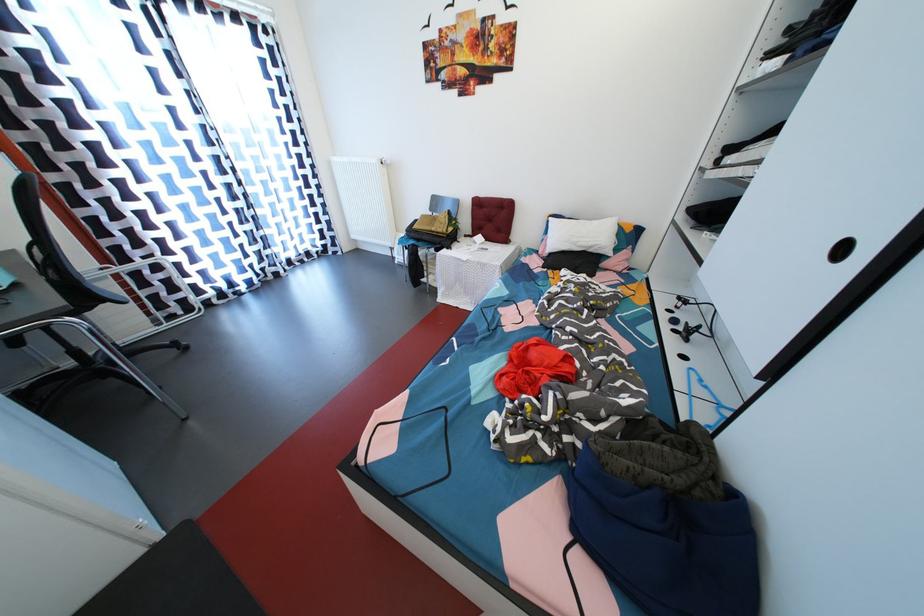
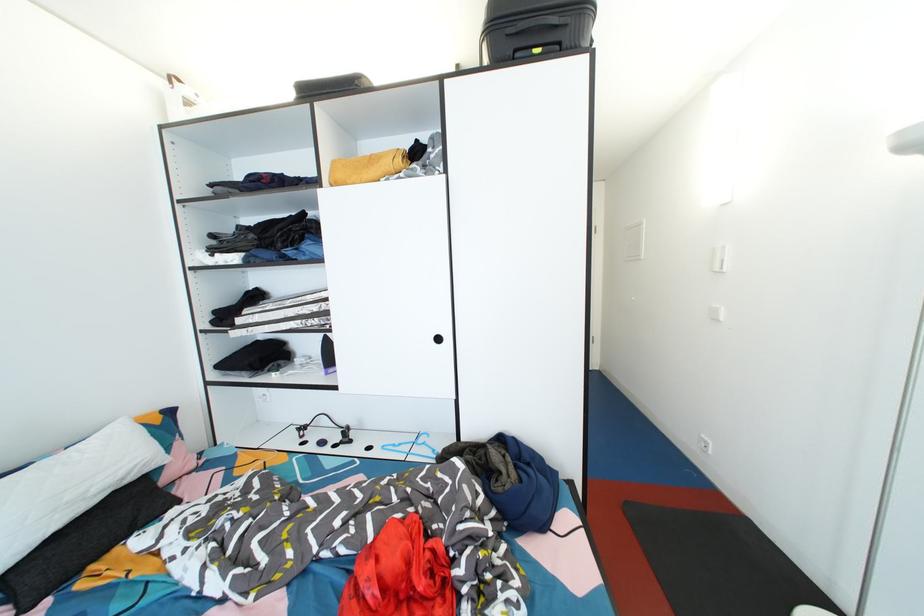
Find the pixel in the second image that matches (597,249) in the first image.

(128, 477)